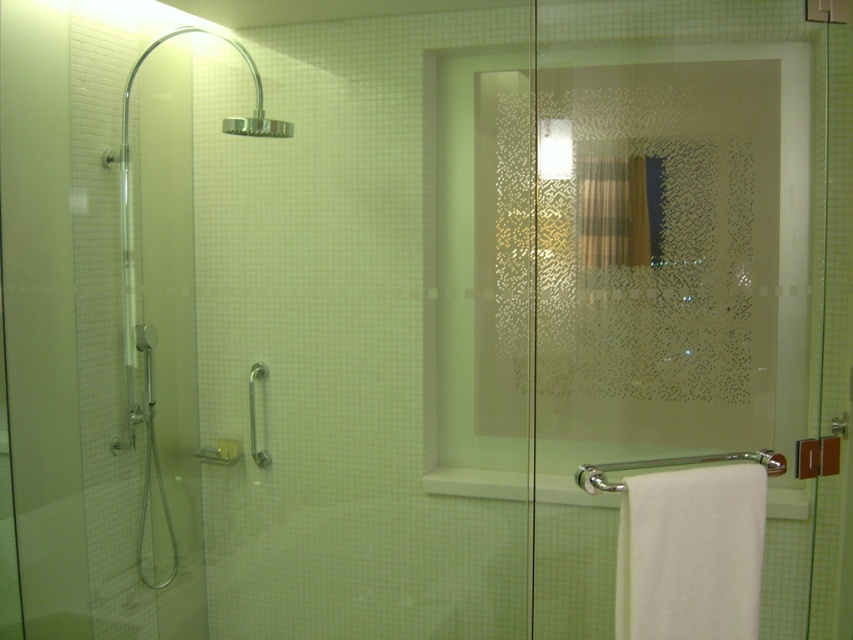
You are designing a layout for a bathroom and need to place a 1.2 meter wide plant stand between the transparent glass shower door at left and the polished chrome towel bar at lower right. Given their widths, will the plant stand fit between them?

The transparent glass shower door at left has a lesser width compared to polished chrome towel bar at lower right, but the total combined width of both objects is not provided. Therefore, it is impossible to determine if the 1.2 meter wide plant stand will fit between them based on the given information.

You are a maintenance worker checking the bathroom layout. You need to ensure that the transparent glass shower door at left is positioned at least 1.8 meters away from the camera for safety regulations. Is the current position compliant?

The transparent glass shower door at left is 1.83 meters away from the camera, which meets the required distance of at least 1.8 meters. Therefore, the current position is compliant with safety regulations.

You need to hang a large beach towel and a small hand towel in the bathroom. The large beach towel requires a wider space to hang. Which object should you use between the polished chrome towel bar at lower right and the silver metallic grab bar at lower left?

The polished chrome towel bar at lower right has a larger width than the silver metallic grab bar at lower left, so it is suitable for hanging the large beach towel that requires more space.